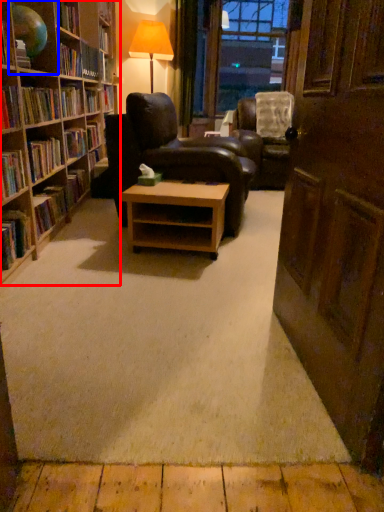
Question: Which of the following is the farthest to the observer, bookcase (highlighted by a red box) or shelf (highlighted by a blue box)?

Choices:
 (A) bookcase
 (B) shelf

Answer: (B)